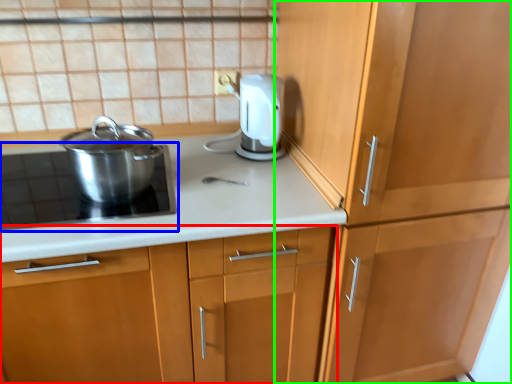
Question: Which is nearer to the cabinetry (highlighted by a red box)? home appliance (highlighted by a blue box) or cabinetry (highlighted by a green box).

Choices:
 (A) home appliance
 (B) cabinetry

Answer: (A)